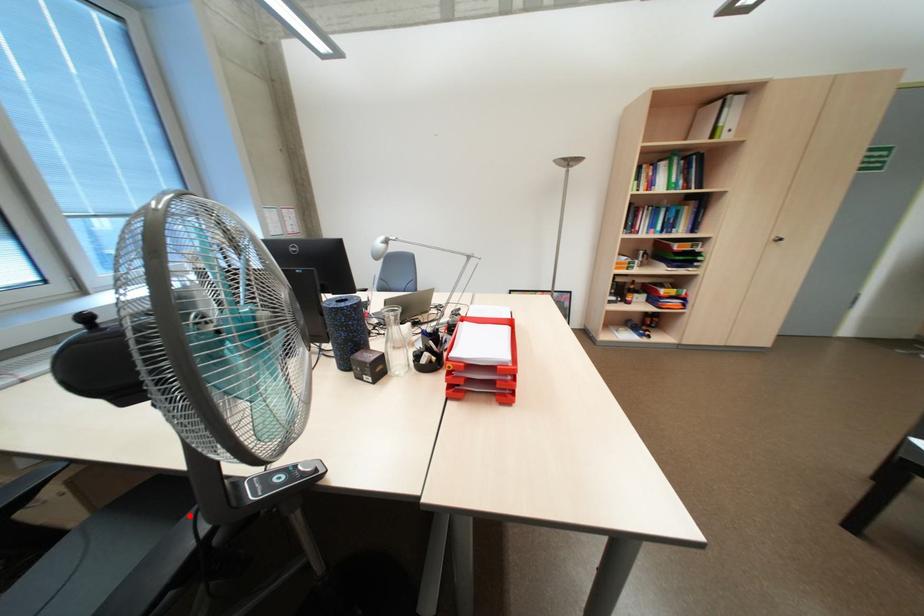
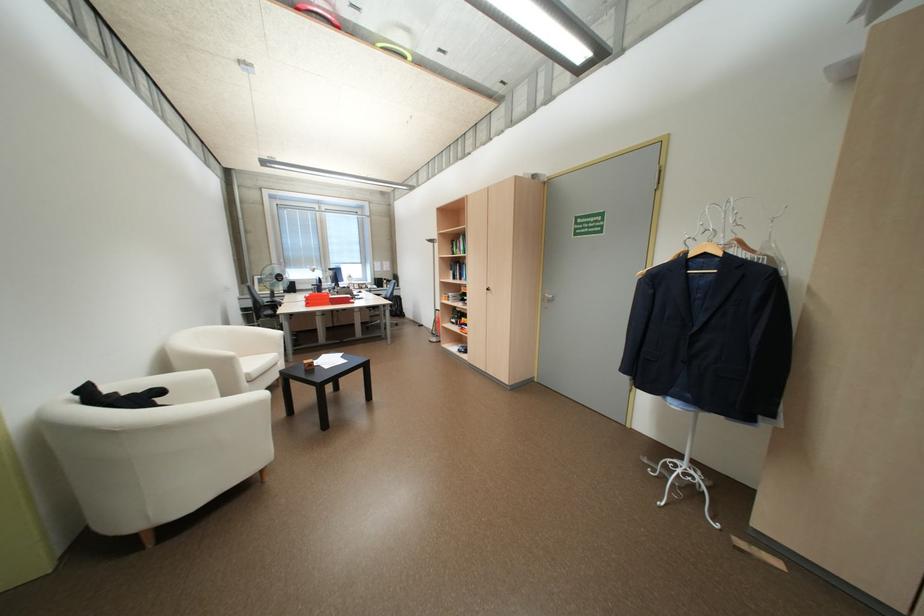
Question: I am providing you with two images of the same scene from different viewpoints. A red point is marked on the first image. At the location where the point appears in image 1, is it still visible in image 2?

Choices:
 (A) Yes
 (B) No

Answer: (B)